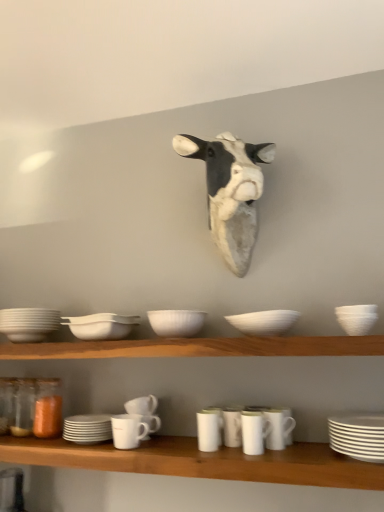
I want to click on free space between white matte mug at lower center, which is counted as the third tableware, starting from the left, and white glossy mug at center, which appears as the seventh tableware when viewed from the left, so click(171, 449).